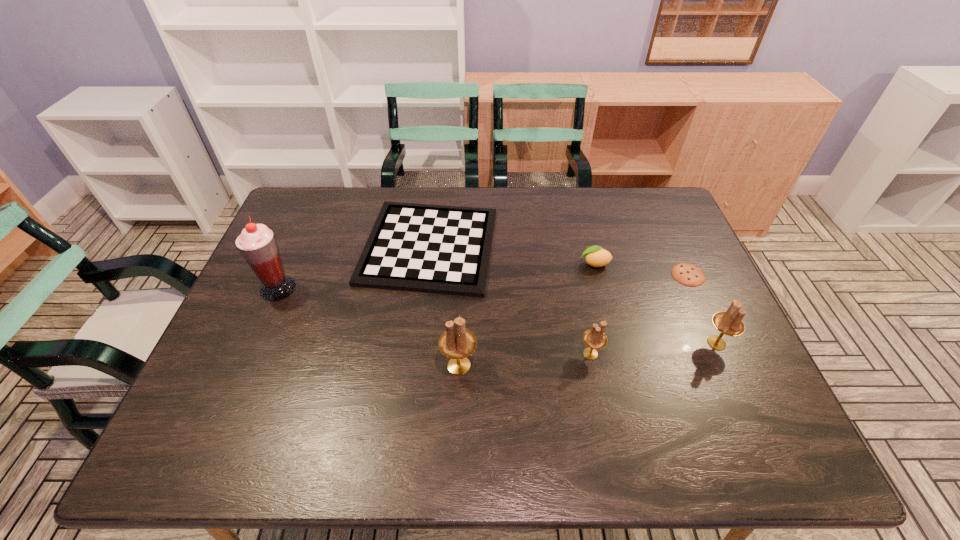
Please point a vacant point for placing a candle holder on the left. Please provide its 2D coordinates. Your answer should be formatted as a tuple, i.e. [(x, y)], where the tuple contains the x and y coordinates of a point satisfying the conditions above.

[(322, 377)]